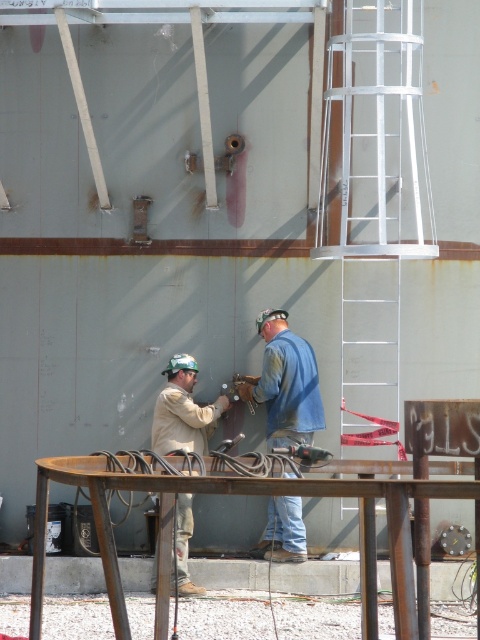
You are a safety inspector checking the construction site. You notice the white metallic ladder at center right and the blue denim jacket at center. Which object is taller?

The white metallic ladder at center right is taller than the blue denim jacket at center.

You are a safety inspector observing the construction site. You notice two workers wearing different clothing items at the center of the scene. Which worker is positioned to the right when looking at the blue denim jacket at center and the tan fabric shirt at center?

The blue denim jacket at center is to the right of the tan fabric shirt at center, so the worker wearing the blue denim jacket at center is positioned to the right.